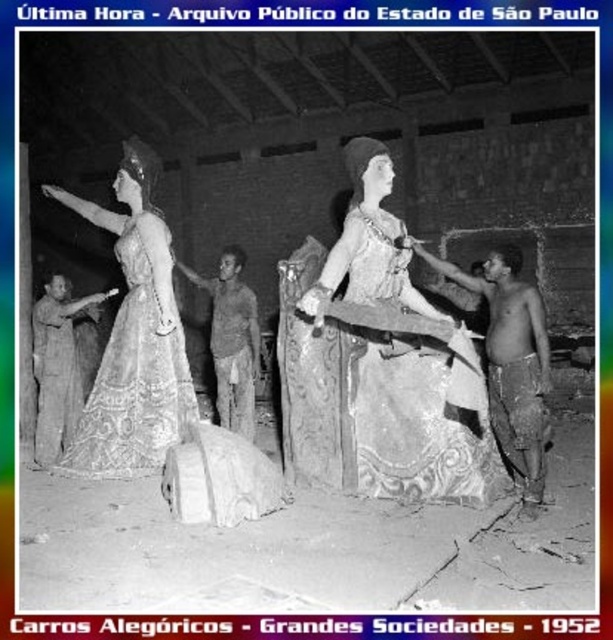
Question: Which object is closer to the camera taking this photo?

Choices:
 (A) brown fabric shirt at left
 (B) matte gold dress at left
 (C) brown textured fabric at center
 (D) shiny bronze statue at right

Answer: (D)

Question: Which point is farther to the camera?

Choices:
 (A) (115, 429)
 (B) (32, 321)
 (C) (230, 312)
 (D) (405, 449)

Answer: (C)

Question: Is matte fabric dress at center below brown textured fabric at center?

Choices:
 (A) no
 (B) yes

Answer: (B)

Question: Considering the relative positions of matte gold dress at left and shiny bronze statue at right in the image provided, where is matte gold dress at left located with respect to shiny bronze statue at right?

Choices:
 (A) above
 (B) below

Answer: (A)

Question: Which object is closer to the camera taking this photo?

Choices:
 (A) brown fabric shirt at left
 (B) matte gold dress at left
 (C) brown textured fabric at center

Answer: (B)

Question: Is matte gold dress at left in front of shiny bronze statue at right?

Choices:
 (A) no
 (B) yes

Answer: (A)